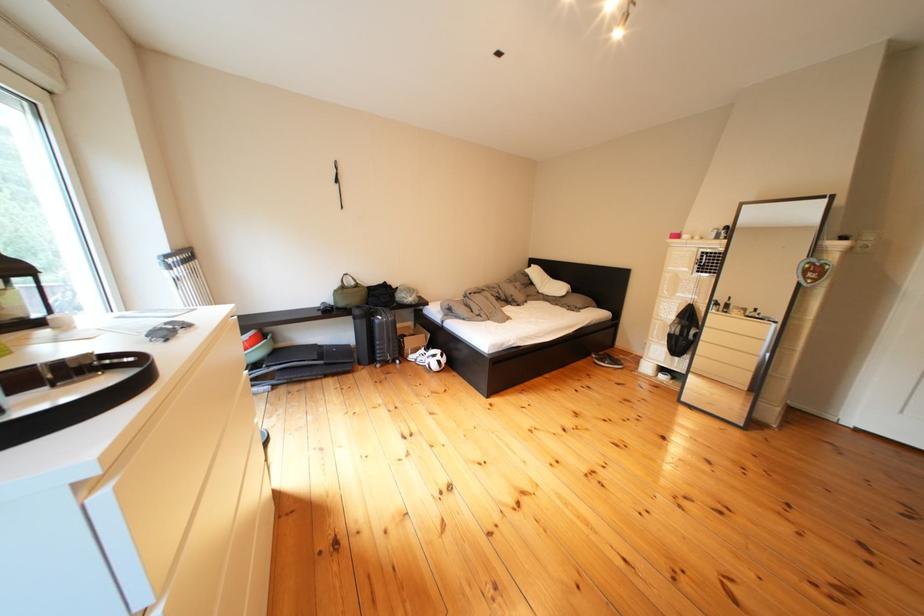
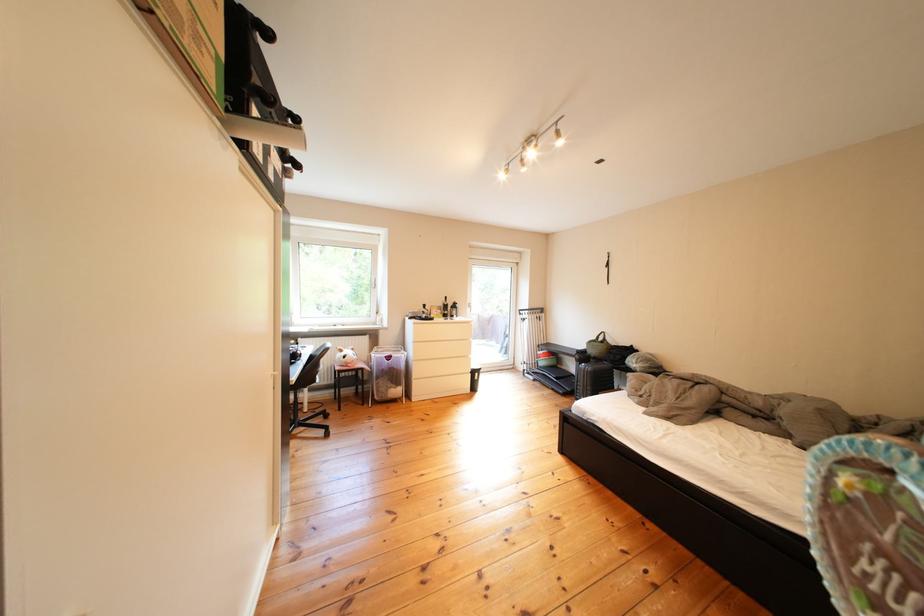
Find the pixel in the second image that matches point (296, 350) in the first image.

(578, 371)